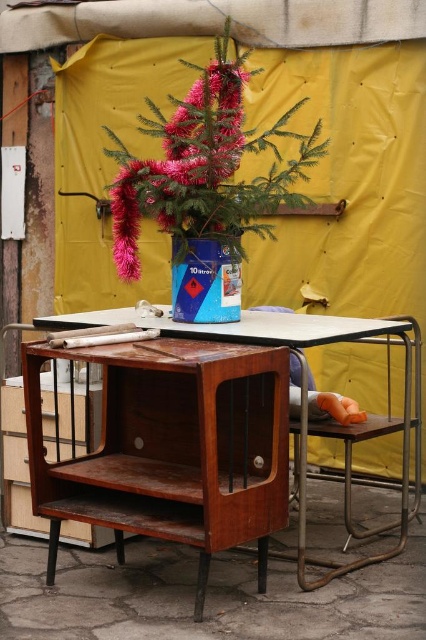
Question: Can you confirm if shiny pink artificial tree at center is thinner than wooden table at center?

Choices:
 (A) no
 (B) yes

Answer: (B)

Question: Which point appears closest to the camera in this image?

Choices:
 (A) (293, 161)
 (B) (290, 330)

Answer: (B)

Question: Can you confirm if shiny pink artificial tree at center is wider than wooden table at center?

Choices:
 (A) no
 (B) yes

Answer: (A)

Question: Which point is closer to the camera taking this photo?

Choices:
 (A) (316, 316)
 (B) (126, 253)

Answer: (B)

Question: Can you confirm if shiny pink artificial tree at center is positioned to the left of wooden table at center?

Choices:
 (A) no
 (B) yes

Answer: (B)